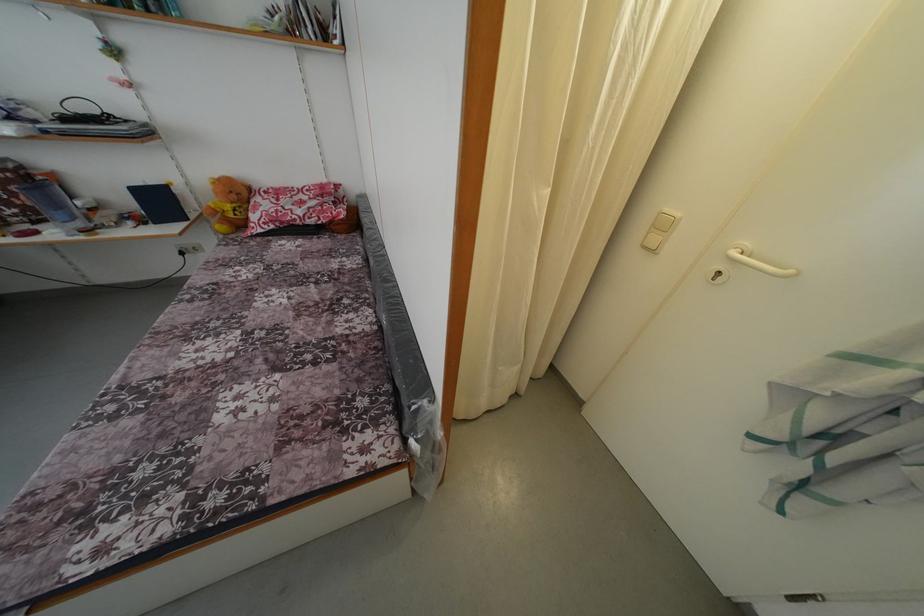
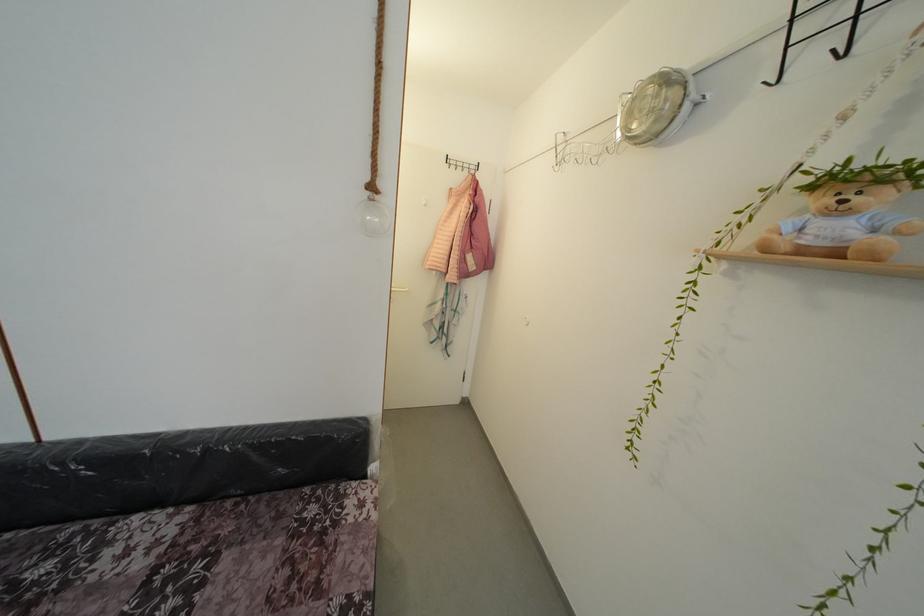
Find the pixel in the second image that matches (x=342, y=325) in the first image.

(99, 585)